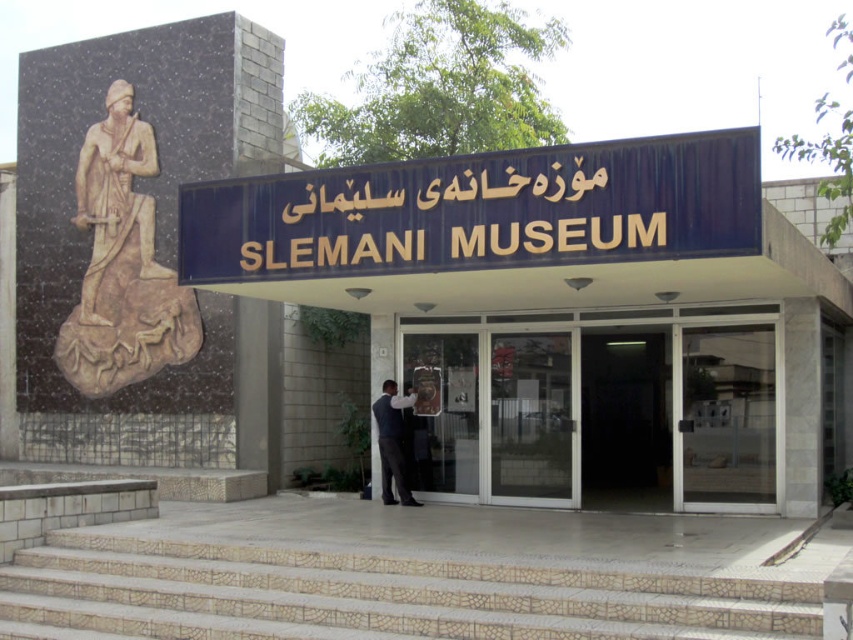
Which is in front, point (120, 289) or point (410, 400)?

Point (410, 400) is in front.

Does point (100, 275) lie in front of point (372, 403)?

No, (100, 275) is further to viewer.

The width and height of the screenshot is (853, 640). In order to click on beige stone statue at left in this screenshot , I will do `click(122, 264)`.

From the picture: Can you confirm if white mosaic stairs at center is wider than beige stone statue at left?

Yes, white mosaic stairs at center is wider than beige stone statue at left.

Which of these two, white mosaic stairs at center or beige stone statue at left, stands shorter?

white mosaic stairs at center

Between point (693, 589) and point (151, 177), which one is positioned in front?

Point (693, 589)

I want to click on white mosaic stairs at center, so click(x=372, y=595).

Based on the photo, does blue metallic sign at center have a lesser width compared to beige stone statue at left?

Yes, blue metallic sign at center is thinner than beige stone statue at left.

Between blue metallic sign at center and beige stone statue at left, which one has less height?

With less height is blue metallic sign at center.

Is point (234, 180) positioned after point (134, 324)?

That is False.

This screenshot has height=640, width=853. In order to click on blue metallic sign at center in this screenshot , I will do `click(480, 211)`.